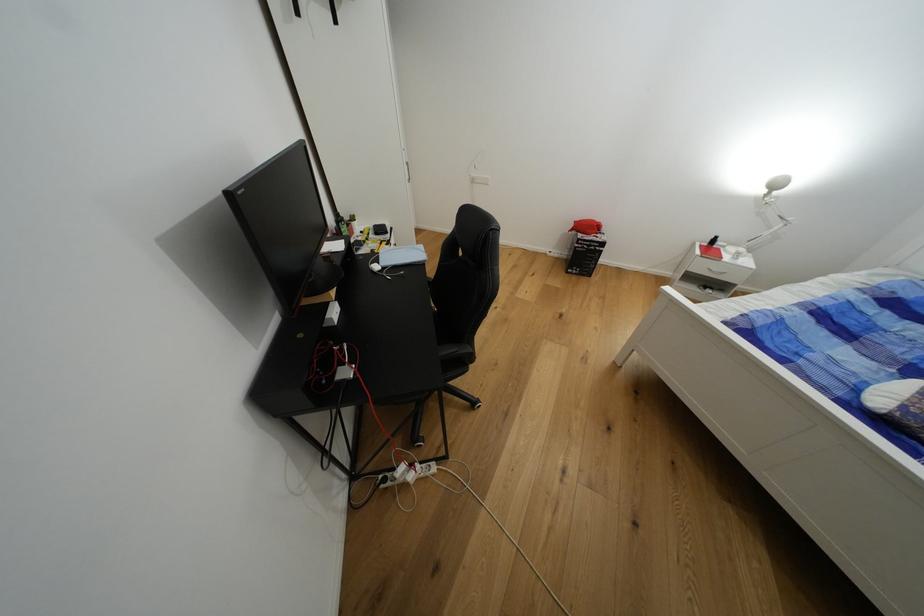
The height and width of the screenshot is (616, 924). Describe the element at coordinates (775, 185) in the screenshot. I see `the white lamp head` at that location.